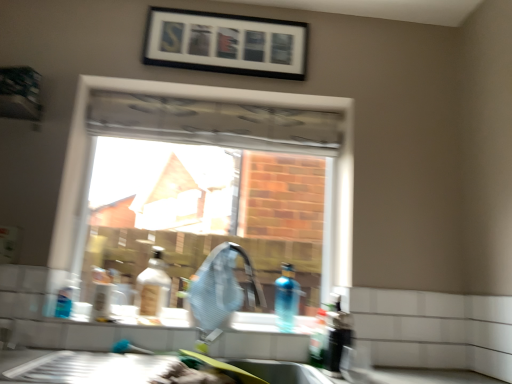
Question: Is white glossy counter top at lower left not within black matte picture frame at upper center?

Choices:
 (A) no
 (B) yes

Answer: (B)

Question: Is white glossy counter top at lower left in front of black matte picture frame at upper center?

Choices:
 (A) no
 (B) yes

Answer: (B)

Question: From a real-world perspective, is white glossy counter top at lower left located higher than black matte picture frame at upper center?

Choices:
 (A) yes
 (B) no

Answer: (B)

Question: Would you say black matte picture frame at upper center is part of white glossy counter top at lower left's contents?

Choices:
 (A) no
 (B) yes

Answer: (A)

Question: Would you say white glossy counter top at lower left is a long distance from black matte picture frame at upper center?

Choices:
 (A) no
 (B) yes

Answer: (B)

Question: Is black matte picture frame at upper center to the left or to the right of blue translucent bottle at sink, the third bottle from the right, in the image?

Choices:
 (A) right
 (B) left

Answer: (B)

Question: Based on their sizes in the image, would you say black matte picture frame at upper center is bigger or smaller than blue translucent bottle at sink, the third bottle from the right?

Choices:
 (A) big
 (B) small

Answer: (A)

Question: Which is correct: black matte picture frame at upper center is inside blue translucent bottle at sink, the 3th bottle positioned from the left, or outside of it?

Choices:
 (A) inside
 (B) outside

Answer: (B)

Question: Does point (270, 66) appear closer or farther from the camera than point (287, 322)?

Choices:
 (A) closer
 (B) farther

Answer: (B)

Question: Would you say white glossy counter top at lower left is inside or outside matte plastic bottle at center, the second bottle viewed from the left?

Choices:
 (A) outside
 (B) inside

Answer: (A)

Question: In terms of size, does white glossy counter top at lower left appear bigger or smaller than matte plastic bottle at center, which ranks as the 4th bottle in right-to-left order?

Choices:
 (A) big
 (B) small

Answer: (A)

Question: Visually, is white glossy counter top at lower left positioned to the left or to the right of matte plastic bottle at center, which ranks as the 4th bottle in right-to-left order?

Choices:
 (A) left
 (B) right

Answer: (B)

Question: Does point (68, 350) appear closer or farther from the camera than point (139, 276)?

Choices:
 (A) closer
 (B) farther

Answer: (A)

Question: Based on their positions, is black matte picture frame at upper center located to the left or right of translucent blue bottle at lower right, the 1th bottle from the right?

Choices:
 (A) right
 (B) left

Answer: (B)

Question: In terms of width, does black matte picture frame at upper center look wider or thinner when compared to translucent blue bottle at lower right, the 1th bottle from the right?

Choices:
 (A) thin
 (B) wide

Answer: (A)